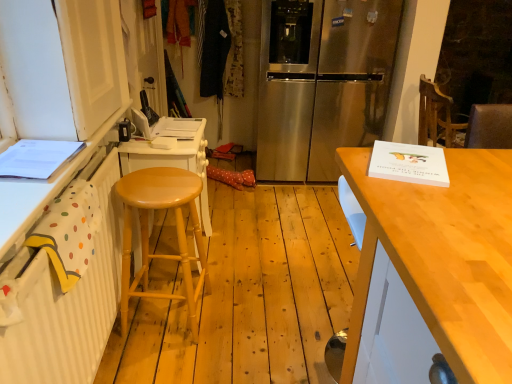
Question: From the image's perspective, is stainless steel refrigerator at center above white painted wood cabinet at left?

Choices:
 (A) yes
 (B) no

Answer: (A)

Question: Can you confirm if stainless steel refrigerator at center is positioned to the right of white painted wood cabinet at left?

Choices:
 (A) yes
 (B) no

Answer: (A)

Question: From a real-world perspective, is stainless steel refrigerator at center on white painted wood cabinet at left?

Choices:
 (A) no
 (B) yes

Answer: (A)

Question: Is stainless steel refrigerator at center positioned before white painted wood cabinet at left?

Choices:
 (A) yes
 (B) no

Answer: (B)

Question: Would you say stainless steel refrigerator at center is outside white painted wood cabinet at left?

Choices:
 (A) yes
 (B) no

Answer: (A)

Question: From their relative heights in the image, would you say stainless steel refrigerator at center is taller or shorter than white painted wood cabinet at left?

Choices:
 (A) tall
 (B) short

Answer: (A)

Question: Relative to white painted wood cabinet at left, is stainless steel refrigerator at center in front or behind?

Choices:
 (A) front
 (B) behind

Answer: (B)

Question: Considering the positions of stainless steel refrigerator at center and white painted wood cabinet at left in the image, is stainless steel refrigerator at center wider or thinner than white painted wood cabinet at left?

Choices:
 (A) wide
 (B) thin

Answer: (A)

Question: Is point (281, 48) closer or farther from the camera than point (2, 64)?

Choices:
 (A) closer
 (B) farther

Answer: (B)

Question: From the image's perspective, relative to stainless steel refrigerator at center, is light wood table at right above or below?

Choices:
 (A) above
 (B) below

Answer: (B)

Question: From a real-world perspective, is light wood table at right physically located above or below stainless steel refrigerator at center?

Choices:
 (A) below
 (B) above

Answer: (A)

Question: Do you think light wood table at right is within stainless steel refrigerator at center, or outside of it?

Choices:
 (A) outside
 (B) inside

Answer: (A)

Question: Relative to stainless steel refrigerator at center, is light wood table at right in front or behind?

Choices:
 (A) behind
 (B) front

Answer: (B)

Question: Looking at the image, does light wood table at right seem bigger or smaller compared to light wood stool at left?

Choices:
 (A) small
 (B) big

Answer: (B)

Question: Relative to light wood stool at left, is light wood table at right in front or behind?

Choices:
 (A) behind
 (B) front

Answer: (B)